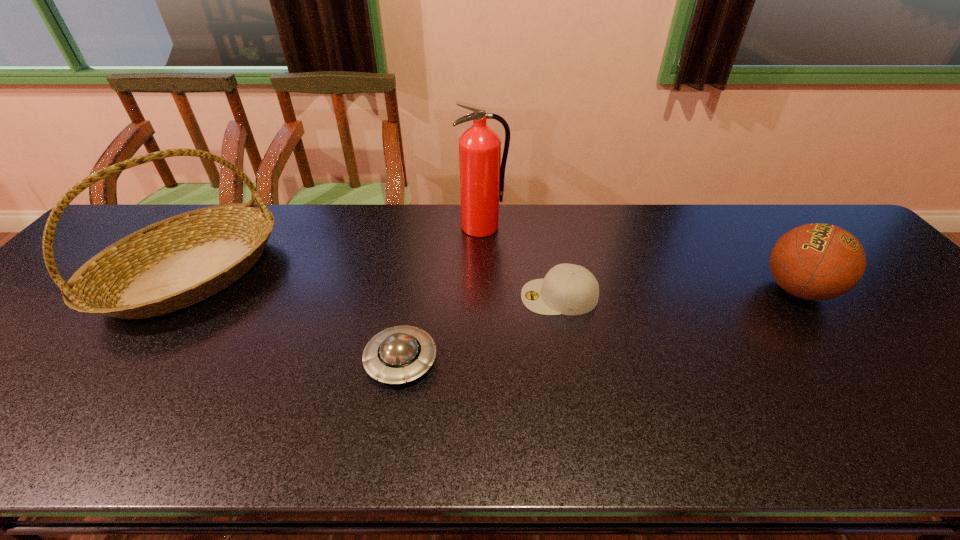
Where is `vacant area that lies between the third object from left to right and the rightmost object`? This screenshot has height=540, width=960. vacant area that lies between the third object from left to right and the rightmost object is located at coordinates (639, 258).

This screenshot has width=960, height=540. What are the coordinates of `free space between the rightmost object and the basket` in the screenshot? It's located at (494, 282).

Where is `free point between the saucer and the third object from left to right`? free point between the saucer and the third object from left to right is located at coordinates [442, 294].

At what (x,y) coordinates should I click in order to perform the action: click on object that can be found as the second closest to the rightmost object. Please return your answer as a coordinate pair (x, y). This screenshot has width=960, height=540. Looking at the image, I should click on (482, 173).

Identify the location of object that is the closest to the saucer. This screenshot has height=540, width=960. (568, 289).